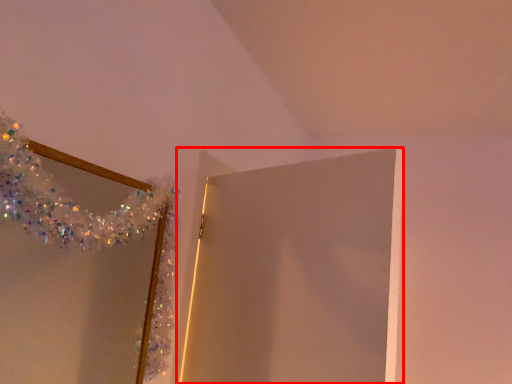
Question: Considering the relative positions of door (annotated by the red box) and mirror in the image provided, where is door (annotated by the red box) located with respect to the staircase?

Choices:
 (A) right
 (B) left

Answer: (A)